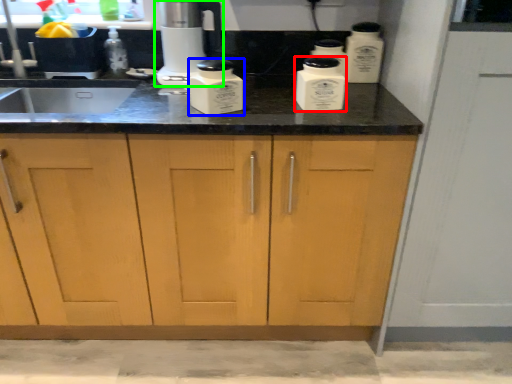
Question: Which is farther away from kitchen appliance (highlighted by a red box)? kitchen appliance (highlighted by a blue box) or home appliance (highlighted by a green box)?

Choices:
 (A) kitchen appliance
 (B) home appliance

Answer: (B)